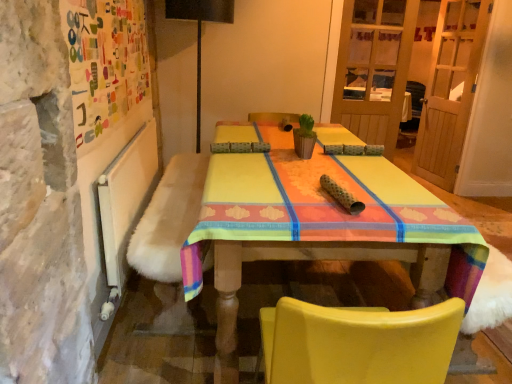
Locate an element on the screen. The width and height of the screenshot is (512, 384). black matte lamp at upper center is located at coordinates (200, 32).

Describe the element at coordinates (200, 32) in the screenshot. I see `black matte lamp at upper center` at that location.

Image resolution: width=512 pixels, height=384 pixels. Identify the location of black matte lamp at upper center. (200, 32).